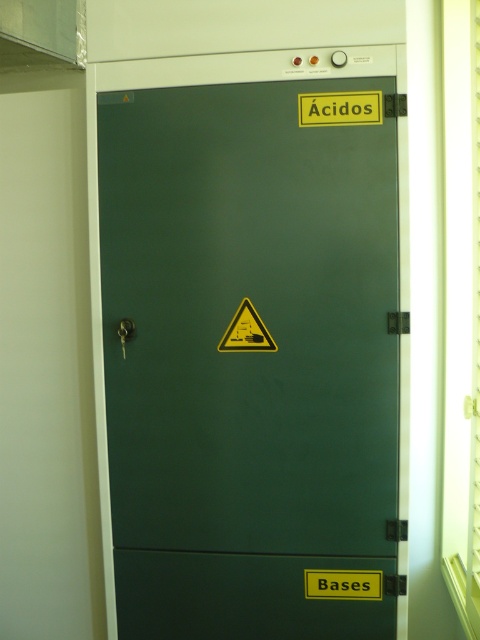
Is green matte cabinet at center shorter than yellowmaterial/texturetriangle at upper center?

Incorrect, green matte cabinet at center's height does not fall short of yellowmaterial/texturetriangle at upper center's.

Which is above, green matte cabinet at center or yellowmaterial/texturetriangle at upper center?

yellowmaterial/texturetriangle at upper center is higher up.

Which is in front, point (303, 323) or point (326, 116)?

Point (326, 116) is more forward.

In order to click on green matte cabinet at center in this screenshot , I will do `click(251, 349)`.

Can you confirm if yellowmaterial/texturetriangle at upper center is taller than yellow triangular warning sign at center?

No, yellowmaterial/texturetriangle at upper center is not taller than yellow triangular warning sign at center.

From the picture: Who is higher up, yellowmaterial/texturetriangle at upper center or yellow triangular warning sign at center?

yellowmaterial/texturetriangle at upper center is above.

Identify the location of yellowmaterial/texturetriangle at upper center. (x=339, y=108).

Find the location of a particular element. The height and width of the screenshot is (640, 480). yellowmaterial/texturetriangle at upper center is located at coordinates (339, 108).

Is green matte cabinet at center wider than yellow triangular warning sign at center?

Indeed, green matte cabinet at center has a greater width compared to yellow triangular warning sign at center.

Which is more to the right, green matte cabinet at center or yellow triangular warning sign at center?

Positioned to the right is green matte cabinet at center.

You are a GUI agent. You are given a task and a screenshot of the screen. Output one action in this format:
    pyautogui.click(x=<x>, y=<y>)
    Task: Click on the green matte cabinet at center
    The image size is (480, 640).
    Given the screenshot: What is the action you would take?
    pyautogui.click(x=251, y=349)

Where is `green matte cabinet at center`? This screenshot has width=480, height=640. green matte cabinet at center is located at coordinates (251, 349).